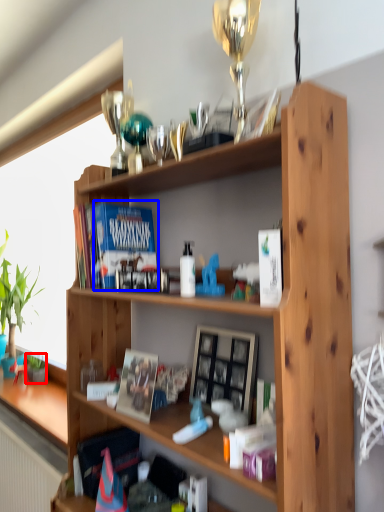
Question: Among these objects, which one is farthest to the camera, houseplant (highlighted by a red box) or paperback book (highlighted by a blue box)?

Choices:
 (A) houseplant
 (B) paperback book

Answer: (A)